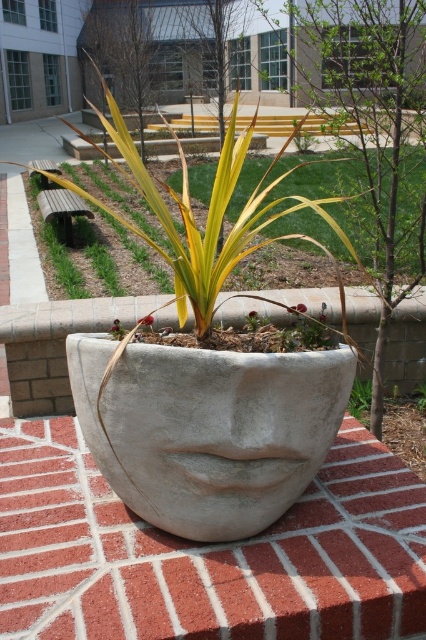
Question: Is white concrete face at center below concrete planter at center?

Choices:
 (A) yes
 (B) no

Answer: (A)

Question: Can you confirm if white concrete face at center is positioned to the right of concrete planter at center?

Choices:
 (A) no
 (B) yes

Answer: (A)

Question: Which point is farther from the camera taking this photo?

Choices:
 (A) (9, 496)
 (B) (60, 316)

Answer: (B)

Question: Is white concrete face at center further to camera compared to concrete planter at center?

Choices:
 (A) no
 (B) yes

Answer: (A)

Question: Which point is closer to the camera?

Choices:
 (A) (166, 316)
 (B) (337, 520)

Answer: (B)

Question: Which point is farther to the camera?

Choices:
 (A) (103, 308)
 (B) (175, 563)

Answer: (A)